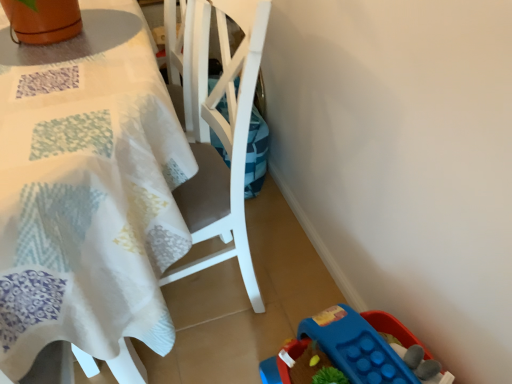
Where is `free spot above blue plastic toy at lower right (from a real-world perspective)`? This screenshot has width=512, height=384. free spot above blue plastic toy at lower right (from a real-world perspective) is located at coordinates (344, 345).